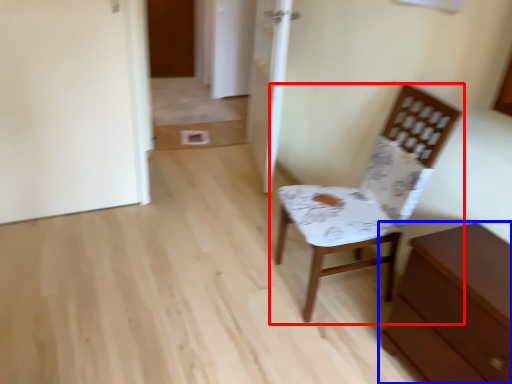
Question: Which point is further to the camera, chair (highlighted by a red box) or chest of drawers (highlighted by a blue box)?

Choices:
 (A) chair
 (B) chest of drawers

Answer: (A)